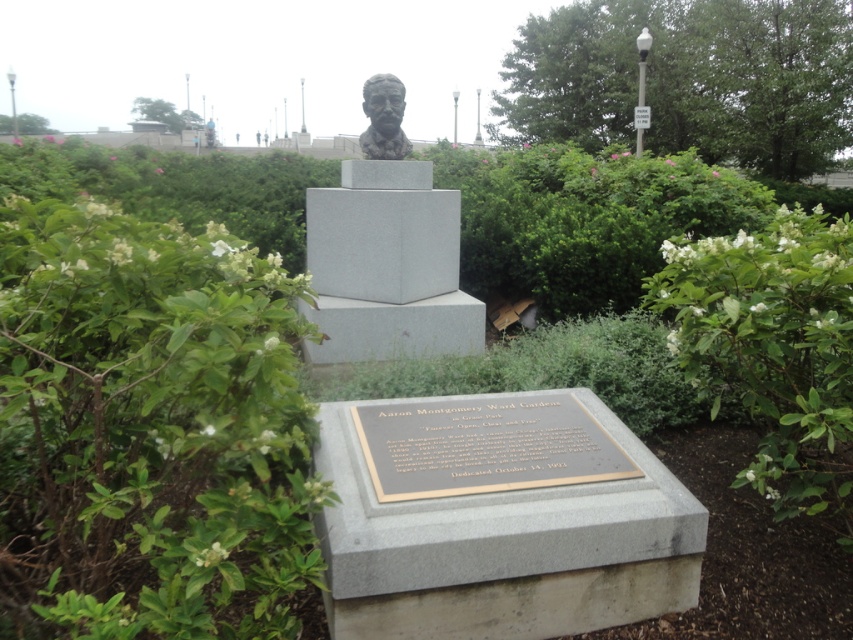
Does point (851, 404) come farther from viewer compared to point (372, 109)?

No, it is not.

At what (x,y) coordinates should I click in order to perform the action: click on white leafy bush at center. Please return your answer as a coordinate pair (x, y). This screenshot has height=640, width=853. Looking at the image, I should click on (773, 349).

Who is more distant from viewer, (x=274, y=529) or (x=776, y=273)?

The point (x=776, y=273) is more distant.

Who is more distant from viewer, (49, 547) or (671, 292)?

Positioned behind is point (671, 292).

This screenshot has height=640, width=853. In order to click on green leafy bush at center in this screenshot , I will do `click(149, 429)`.

Between point (215, 548) and point (627, 97), which one is positioned in front?

Point (215, 548) is more forward.

What do you see at coordinates (149, 429) in the screenshot? The image size is (853, 640). I see `green leafy bush at center` at bounding box center [149, 429].

At what (x,y) coordinates should I click in order to perform the action: click on green leafy bush at center. Please return your answer as a coordinate pair (x, y). Looking at the image, I should click on (149, 429).